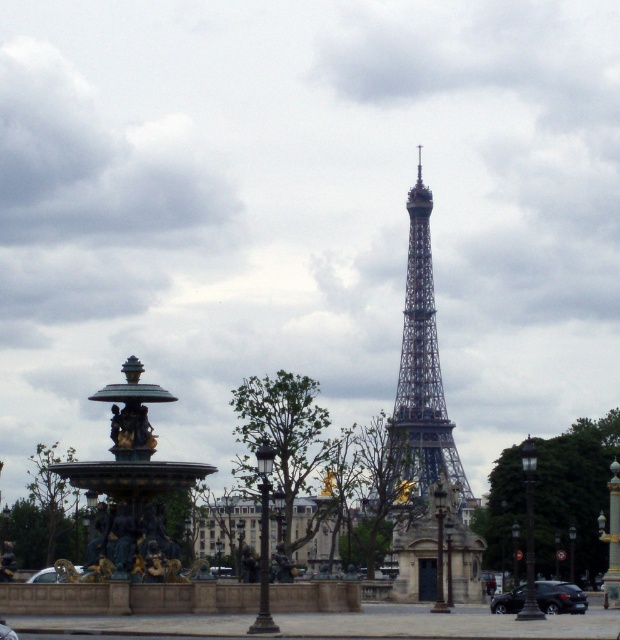
In the scene shown: You are a tourist standing in front of the Eiffel Tower and see the bronze sculpture fountain at left and the metallic silver car at lower left. Which object is located to the right of the other?

The bronze sculpture fountain at left is positioned on the right side of metallic silver car at lower left, so the bronze sculpture fountain at left is to the right of the metallic silver car at lower left.

You are a tourist standing in front of the shiny steel eiffel tower at center. You want to take a photo that captures the entire structure. Considering the distance, will you need to use a wide angle lens to ensure the entire tower fits in the frame?

The shiny steel eiffel tower at center is 648.73 meters away from camera. At this distance, a standard lens should suffice to capture the entire tower without needing a wide angle lens.

You are standing at the center of the plaza and want to take a photo of the shiny steel eiffel tower at center. In which direction should you point your camera to capture it?

Since the shiny steel eiffel tower at center is located at point coordinates of (423, 364), you should point your camera towards the center of the plaza to capture it.